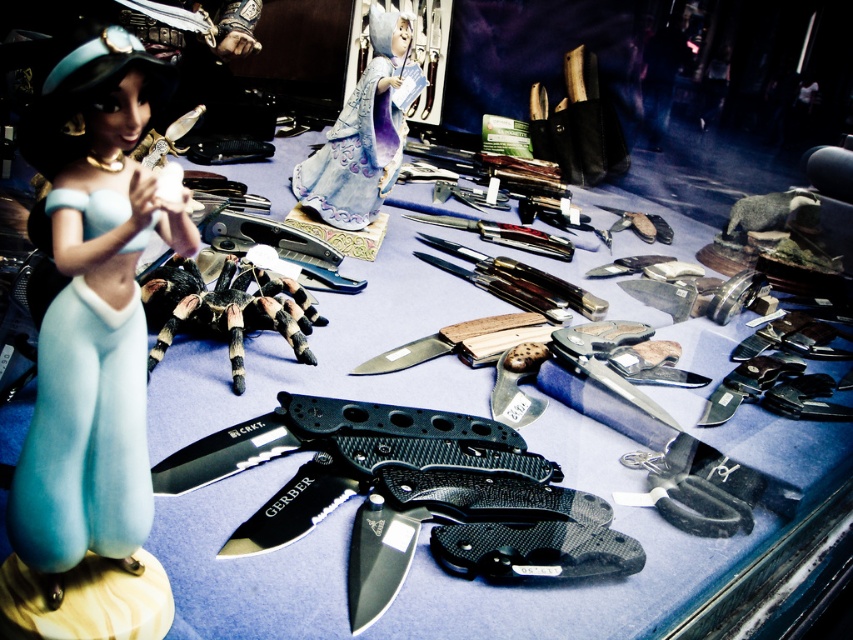
Consider the image. Does black carbon fiber knife at center have a lesser height compared to porcelain figurine at center?

Correct, black carbon fiber knife at center is not as tall as porcelain figurine at center.

At what (x,y) coordinates should I click in order to perform the action: click on black carbon fiber knife at center. Please return your answer as a coordinate pair (x, y). Looking at the image, I should click on (407, 493).

Can you confirm if matte blue figurine at left is positioned to the right of black carbon fiber knife at center?

In fact, matte blue figurine at left is to the left of black carbon fiber knife at center.

Does matte blue figurine at left have a smaller size compared to black carbon fiber knife at center?

Yes.

Is point (77, 154) closer to camera compared to point (572, 563)?

That is True.

I want to click on matte blue figurine at left, so click(x=93, y=308).

Who is higher up, matte blue figurine at left or black hairy tarantula at center?

Positioned higher is black hairy tarantula at center.

Does point (149, 490) lie behind point (177, 282)?

No, (149, 490) is in front of (177, 282).

Locate an element on the screen. matte blue figurine at left is located at coordinates (93, 308).